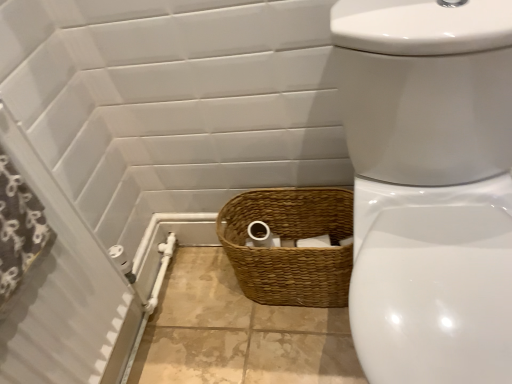
Question: Is brown woven basket at lower center not near white glossy toilet at center?

Choices:
 (A) no
 (B) yes

Answer: (A)

Question: Is brown woven basket at lower center facing towards white glossy toilet at center?

Choices:
 (A) no
 (B) yes

Answer: (A)

Question: Is the position of brown woven basket at lower center less distant than that of white glossy toilet at center?

Choices:
 (A) no
 (B) yes

Answer: (A)

Question: Does brown woven basket at lower center have a lesser width compared to white glossy toilet at center?

Choices:
 (A) yes
 (B) no

Answer: (A)

Question: Is brown woven basket at lower center positioned behind white glossy toilet at center?

Choices:
 (A) yes
 (B) no

Answer: (A)

Question: From the image's perspective, is white glossy toilet at center positioned above or below white textured screen door at left?

Choices:
 (A) below
 (B) above

Answer: (A)

Question: Considering the positions of white glossy toilet at center and white textured screen door at left in the image, is white glossy toilet at center bigger or smaller than white textured screen door at left?

Choices:
 (A) big
 (B) small

Answer: (A)

Question: Choose the correct answer: Is white glossy toilet at center inside white textured screen door at left or outside it?

Choices:
 (A) inside
 (B) outside

Answer: (B)

Question: Is white glossy toilet at center taller or shorter than white textured screen door at left?

Choices:
 (A) tall
 (B) short

Answer: (B)

Question: Considering the positions of white glossy toilet at center and black fabric shower curtain at left in the image, is white glossy toilet at center bigger or smaller than black fabric shower curtain at left?

Choices:
 (A) small
 (B) big

Answer: (B)

Question: Is white glossy toilet at center in front of or behind black fabric shower curtain at left in the image?

Choices:
 (A) behind
 (B) front

Answer: (B)

Question: Is white glossy toilet at center inside or outside of black fabric shower curtain at left?

Choices:
 (A) inside
 (B) outside

Answer: (B)

Question: From the image's perspective, relative to black fabric shower curtain at left, is white glossy toilet at center above or below?

Choices:
 (A) above
 (B) below

Answer: (B)

Question: Is white glossy toilet at center in front of or behind brown woven basket at lower center in the image?

Choices:
 (A) front
 (B) behind

Answer: (A)

Question: Would you say white glossy toilet at center is to the left or to the right of brown woven basket at lower center in the picture?

Choices:
 (A) left
 (B) right

Answer: (B)